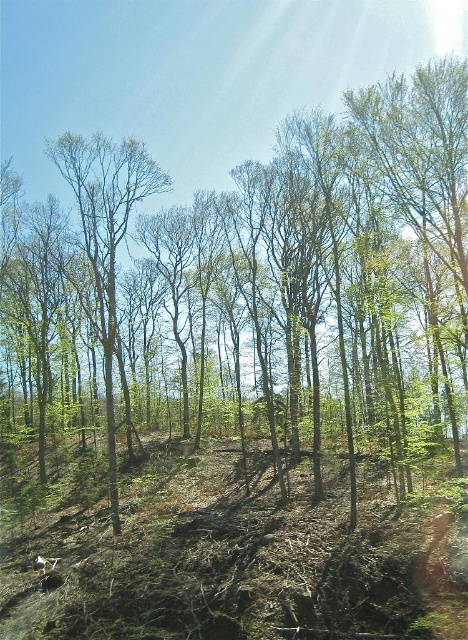
Is point (421, 529) positioned behind point (107, 176)?

No, it is not.

Which is in front, point (358, 618) or point (130, 442)?

Positioned in front is point (358, 618).

Who is more forward, [389,580] or [104,294]?

Point [389,580] is more forward.

Identify the location of brown dirt at center. This screenshot has height=640, width=468. (242, 560).